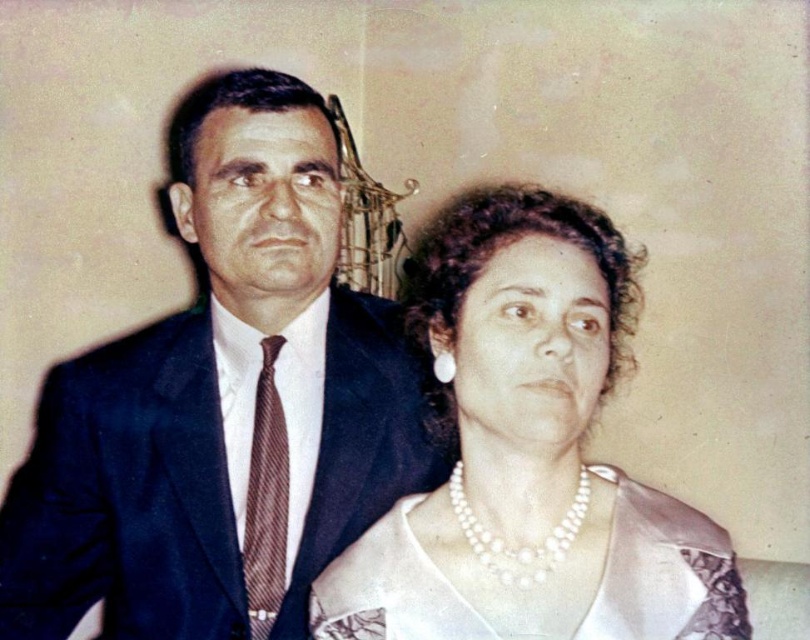
Is dark blue suit at left to the left of brown striped tie at left from the viewer's perspective?

Correct, you'll find dark blue suit at left to the left of brown striped tie at left.

Is dark blue suit at left thinner than brown striped tie at left?

In fact, dark blue suit at left might be wider than brown striped tie at left.

Find the location of `dark blue suit at left`. dark blue suit at left is located at coordinates (222, 404).

Identify the location of dark blue suit at left. (222, 404).

Is dark blue suit at left positioned in front of white satin dress at center?

That is False.

Where is `dark blue suit at left`? The image size is (810, 640). dark blue suit at left is located at coordinates (222, 404).

Is point (150, 636) positioned behind point (672, 538)?

Yes, it is behind point (672, 538).

Identify the location of dark blue suit at left. (222, 404).

Is white satin dress at center closer to the viewer compared to brown striped tie at left?

Yes, it is.

Between white satin dress at center and brown striped tie at left, which one has less height?

With less height is white satin dress at center.

This screenshot has width=810, height=640. Describe the element at coordinates (663, 572) in the screenshot. I see `white satin dress at center` at that location.

At what (x,y) coordinates should I click in order to perform the action: click on white satin dress at center. Please return your answer as a coordinate pair (x, y). Looking at the image, I should click on coord(663,572).